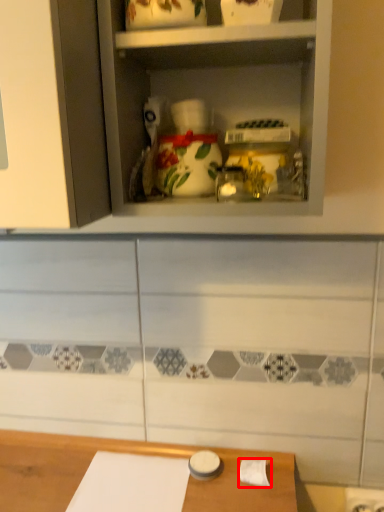
Question: Considering the relative positions of toilet paper (annotated by the red box) and shelf in the image provided, where is toilet paper (annotated by the red box) located with respect to the staircase?

Choices:
 (A) left
 (B) right

Answer: (B)